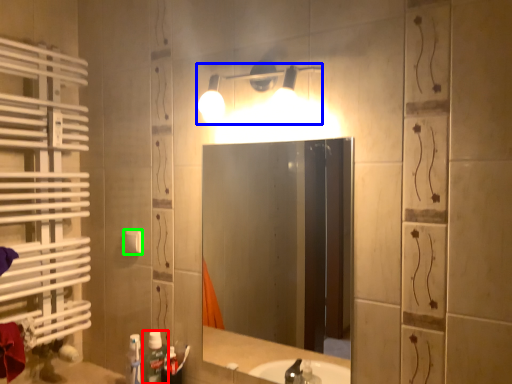
Question: Considering the real-world distances, which object is closest to bottle (highlighted by a red box)? light fixture (highlighted by a blue box) or light switch (highlighted by a green box).

Choices:
 (A) light fixture
 (B) light switch

Answer: (B)